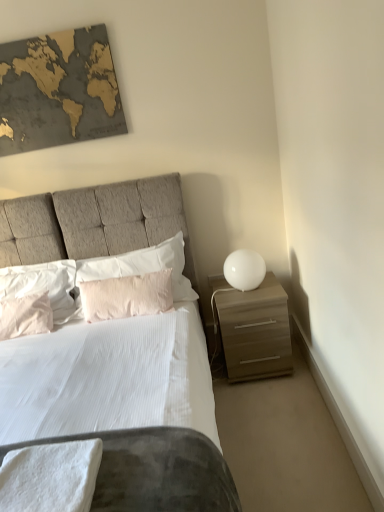
This screenshot has height=512, width=384. Find the location of `free space above gold textured map at upper left (from a real-world perspective)`. free space above gold textured map at upper left (from a real-world perspective) is located at coordinates (44, 30).